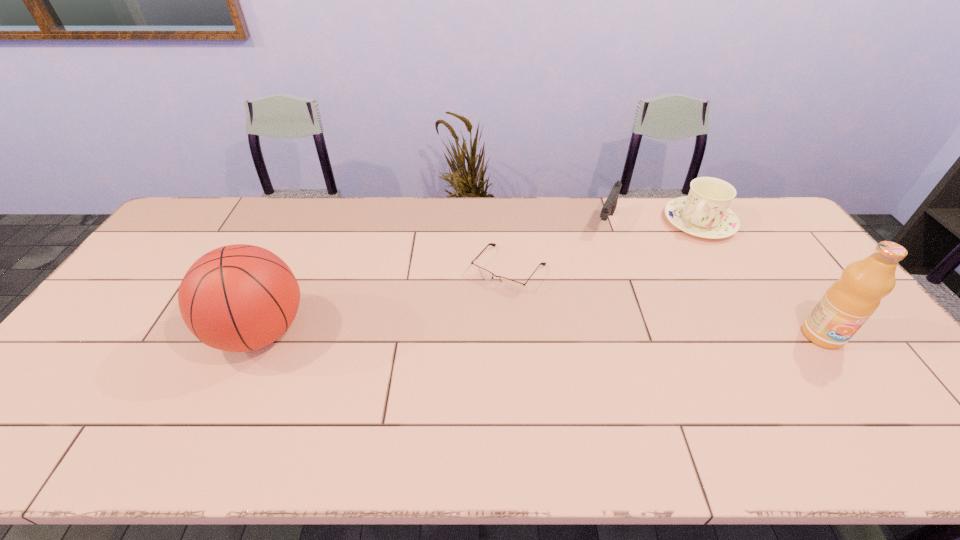
Locate an element on the screen. This screenshot has width=960, height=540. the leftmost object is located at coordinates (238, 298).

Locate an element on the screen. fruit juice is located at coordinates (848, 303).

The height and width of the screenshot is (540, 960). I want to click on the third object from right to left, so click(x=610, y=204).

Image resolution: width=960 pixels, height=540 pixels. What are the coordinates of `chinaware` in the screenshot? It's located at (704, 213).

Image resolution: width=960 pixels, height=540 pixels. Find the location of `the fourth object from right to left`. the fourth object from right to left is located at coordinates (509, 284).

Where is `the third farthest object`? the third farthest object is located at coordinates (509, 284).

Find the location of `free space located on the front of the leftmost object`. free space located on the front of the leftmost object is located at coordinates (228, 403).

Where is `vacant space located 0.060m on the front label of the fruit juice`? This screenshot has height=540, width=960. vacant space located 0.060m on the front label of the fruit juice is located at coordinates (847, 370).

Where is `blank space located 0.370m at the barrel of the pistol`? This screenshot has width=960, height=540. blank space located 0.370m at the barrel of the pistol is located at coordinates (569, 310).

Find the location of a particular element. free space located 0.280m at the barrel of the pistol is located at coordinates (579, 289).